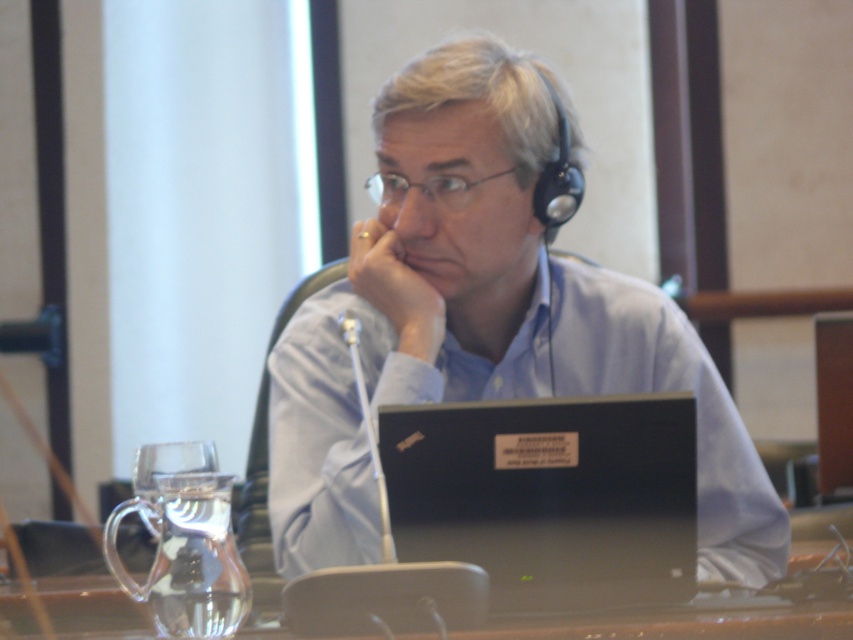
You are setting up a presentation and need to place a 15cm tall model on the transparent glass table at center. The black matte laptop at center is currently on the table. Can the model be placed on the table without covering the laptop?

The black matte laptop at center is much taller than the transparent glass table at center, so placing a 15cm tall model on the table may not be possible as the laptop is already occupying significant height space. However, the description only mentions the laptop being taller, not its base dimensions. If the table has enough surface area around the laptop, the model could be placed there. But based on the given info about height, the model might not fit vertically.

You are a delivery robot that needs to place a small package between the clear glass wine glass at lower left and the skinny white jaw at center. The package is 15 inches long. Can you fit it in the space between them?

The distance between the clear glass wine glass at lower left and the skinny white jaw at center is 18.04 inches. Since the package is 15 inches long, it can fit in the space between them.

You are setting up for a video call and need to place a microphone between the clear glass wine glass at lower left and the skinny white jaw at center. Based on their positions, where should you place the microphone?

The clear glass wine glass at lower left is positioned on the left side of skinny white jaw at center, so you should place the microphone to the right of the clear glass wine glass at lower left and to the left of the skinny white jaw at center to position it between them.